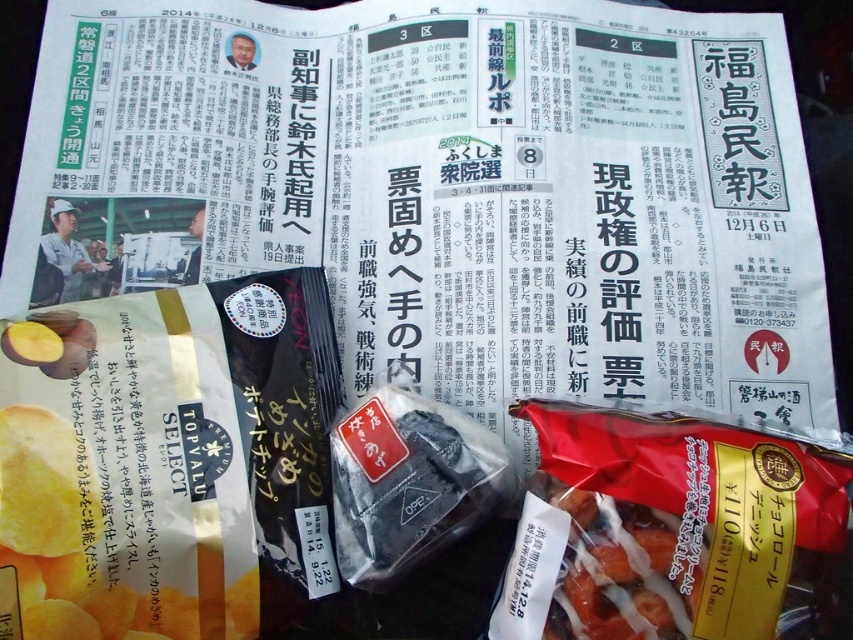
Does yellow matte potato chips at lower left have a lesser height compared to shiny brown snack at center?

No.

Which is more to the right, yellow matte potato chips at lower left or shiny brown snack at center?

shiny brown snack at center

Is point (167, 600) more distant than point (589, 582)?

Yes, point (167, 600) is farther from viewer.

In order to click on yellow matte potato chips at lower left in this screenshot , I will do `click(125, 525)`.

Does black matte bag at center have a larger size compared to shiny brown snack at center?

Correct, black matte bag at center is larger in size than shiny brown snack at center.

Is black matte bag at center positioned behind shiny brown snack at center?

Yes, black matte bag at center is behind shiny brown snack at center.

Which is behind, point (329, 436) or point (666, 566)?

The point (329, 436) is behind.

Locate an element on the screen. black matte bag at center is located at coordinates (409, 483).

Between yellow matte potato chips at lower left and black matte bag at center, which one is positioned lower?

yellow matte potato chips at lower left is lower down.

Does point (86, 496) come closer to viewer compared to point (349, 490)?

Yes, it is in front of point (349, 490).

The image size is (853, 640). What do you see at coordinates (125, 525) in the screenshot?
I see `yellow matte potato chips at lower left` at bounding box center [125, 525].

This screenshot has height=640, width=853. Find the location of `yellow matte potato chips at lower left`. yellow matte potato chips at lower left is located at coordinates (125, 525).